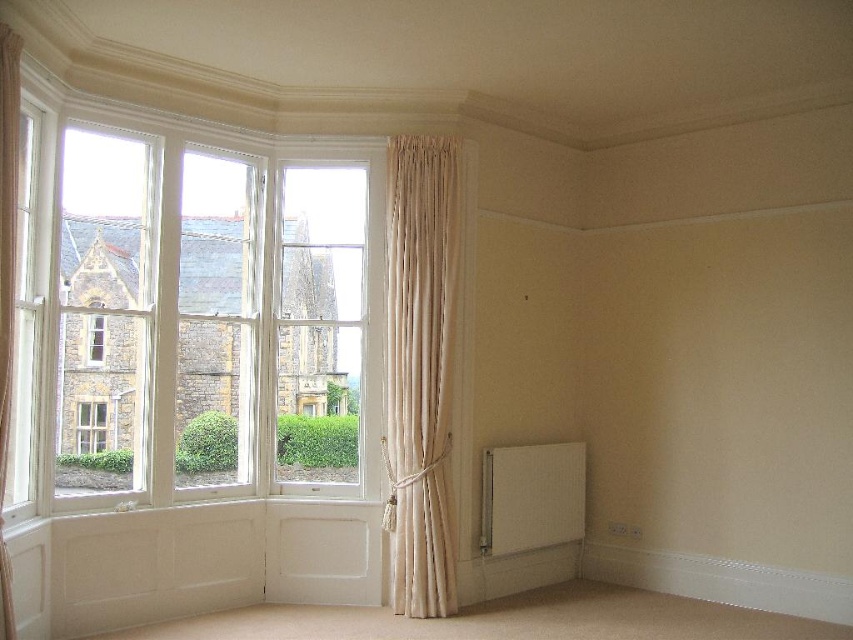
You are an interior designer planning to place a 1.5 meter wide sofa in this room. The sofa will be positioned between the white matte radiator at lower right and the clear glass window at left. Based on the spatial arrangement, will the sofa fit between them?

The white matte radiator at lower right is wider than the clear glass window at left. However, since the radiator is at the lower right and the window is at the left, the distance between them isn

You are standing in the room and notice a point marked at coordinates (419, 369). Based on the scene description, what object is located at that point?

The point at coordinates (419, 369) corresponds to the beige velvet curtain at center.

You are standing in the room and want to place a small potted plant on the radiator to keep it warm. However, you notice the clear glass window at left is open. Could the white matte radiator at lower right still effectively heat the plant if the window is open?

The white matte radiator at lower right is positioned under the clear glass window at left. Even with the window open, the radiator can still provide some heat to the plant, but its effectiveness may be reduced due to the open window causing heat loss.